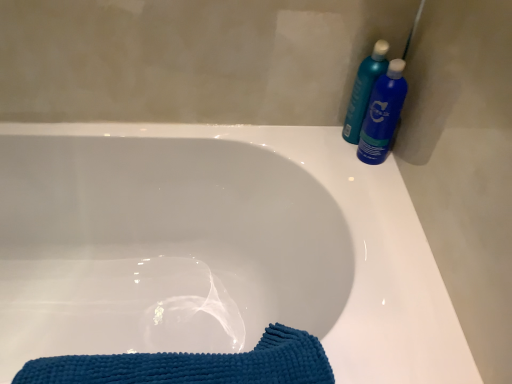
The height and width of the screenshot is (384, 512). Find the location of `vacant area that is in front of teal plastic bottles at upper right, which is the first cleaning product in left-to-right order`. vacant area that is in front of teal plastic bottles at upper right, which is the first cleaning product in left-to-right order is located at coordinates (365, 175).